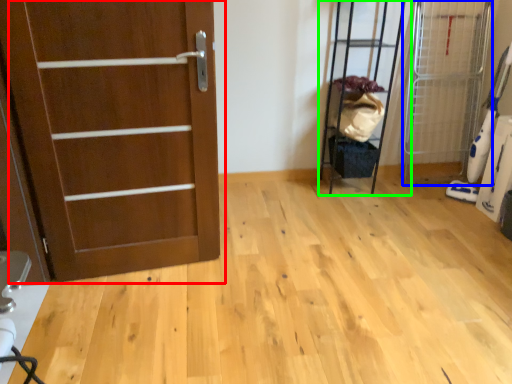
Question: Which is nearer to the door (highlighted by a red box)? elevator (highlighted by a blue box) or elevator (highlighted by a green box).

Choices:
 (A) elevator
 (B) elevator

Answer: (B)